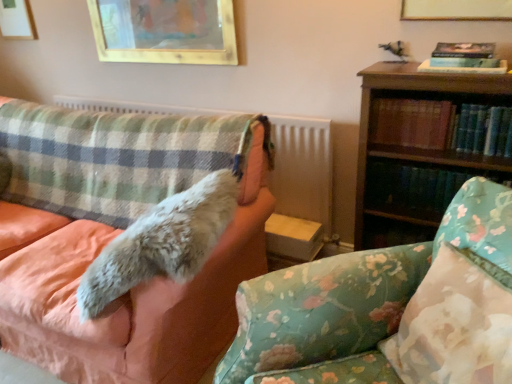
Question: Is wooden picture frame at upper left, marked as the third picture frame in a right-to-left arrangement, to the left of fluffy white fur at left from the viewer's perspective?

Choices:
 (A) no
 (B) yes

Answer: (B)

Question: Considering the relative positions of wooden picture frame at upper left, the first picture frame viewed from the back, and fluffy white fur at left in the image provided, is wooden picture frame at upper left, the first picture frame viewed from the back, in front of fluffy white fur at left?

Choices:
 (A) yes
 (B) no

Answer: (B)

Question: Could you tell me if wooden picture frame at upper left, the 3th picture frame in the front-to-back sequence, is facing fluffy white fur at left?

Choices:
 (A) no
 (B) yes

Answer: (A)

Question: Considering the relative sizes of wooden picture frame at upper left, the first picture frame viewed from the back, and fluffy white fur at left in the image provided, is wooden picture frame at upper left, the first picture frame viewed from the back, thinner than fluffy white fur at left?

Choices:
 (A) no
 (B) yes

Answer: (B)

Question: Is wooden picture frame at upper left, which ranks as the 1th picture frame in left-to-right order, far away from fluffy white fur at left?

Choices:
 (A) yes
 (B) no

Answer: (A)

Question: Is hardcover book at upper right, the third book in the bottom-to-top sequence, wider or thinner than fluffy white fur at left?

Choices:
 (A) thin
 (B) wide

Answer: (A)

Question: Considering the positions of hardcover book at upper right, the first book viewed from the top, and fluffy white fur at left in the image, is hardcover book at upper right, the first book viewed from the top, bigger or smaller than fluffy white fur at left?

Choices:
 (A) small
 (B) big

Answer: (A)

Question: From the image's perspective, is hardcover book at upper right, the third book in the bottom-to-top sequence, located above or below fluffy white fur at left?

Choices:
 (A) below
 (B) above

Answer: (B)

Question: Relative to fluffy white fur at left, is hardcover book at upper right, the third book in the bottom-to-top sequence, in front or behind?

Choices:
 (A) front
 (B) behind

Answer: (B)

Question: In terms of height, does hardcover book at right, the 3th book in the top-to-bottom sequence, look taller or shorter compared to hardcover book at right, the second book when ordered from top to bottom?

Choices:
 (A) short
 (B) tall

Answer: (A)

Question: Is hardcover book at right, the first book when ordered from bottom to top, wider or thinner than hardcover book at right, which appears as the second book when ordered from the bottom?

Choices:
 (A) wide
 (B) thin

Answer: (A)

Question: Is point (370, 205) closer or farther from the camera than point (401, 127)?

Choices:
 (A) closer
 (B) farther

Answer: (B)

Question: Is hardcover book at right, the first book when ordered from bottom to top, bigger or smaller than hardcover book at right, the second book when ordered from top to bottom?

Choices:
 (A) small
 (B) big

Answer: (B)

Question: Looking at their shapes, would you say fluffy fabric couch at center, the 2th studio couch viewed from the right, is wider or thinner than plaid fabric radiator at left?

Choices:
 (A) wide
 (B) thin

Answer: (A)

Question: Relative to plaid fabric radiator at left, is fluffy fabric couch at center, which ranks as the first studio couch in left-to-right order, in front or behind?

Choices:
 (A) front
 (B) behind

Answer: (A)